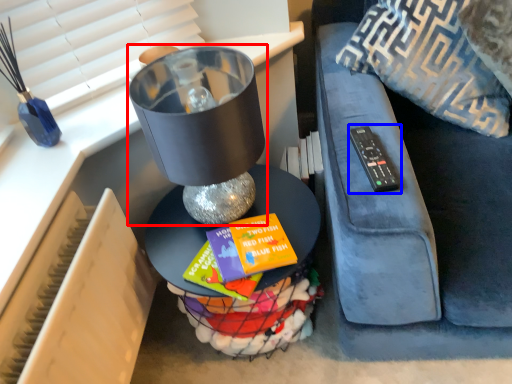
Question: Which of the following is the farthest to the observer, table lamp (highlighted by a red box) or remote (highlighted by a blue box)?

Choices:
 (A) table lamp
 (B) remote

Answer: (B)